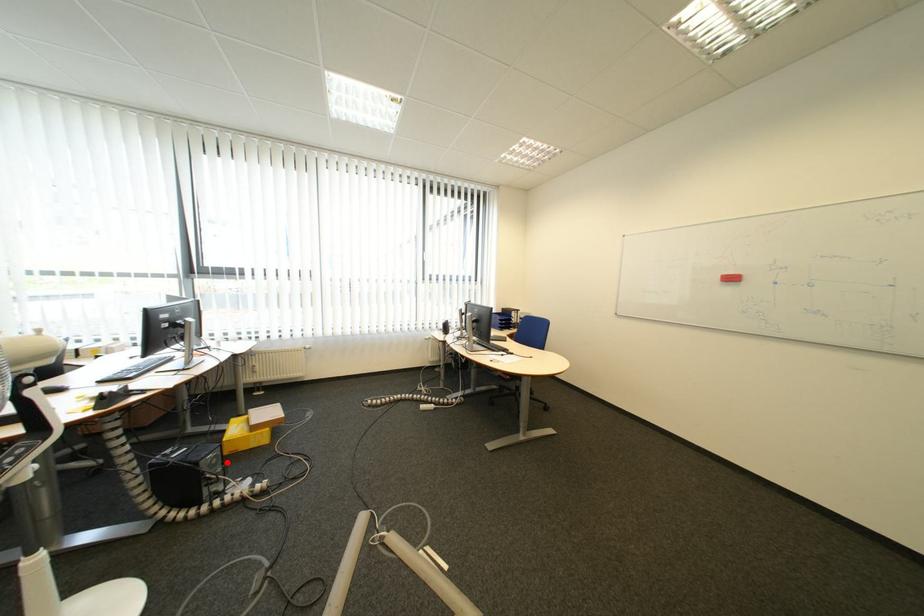
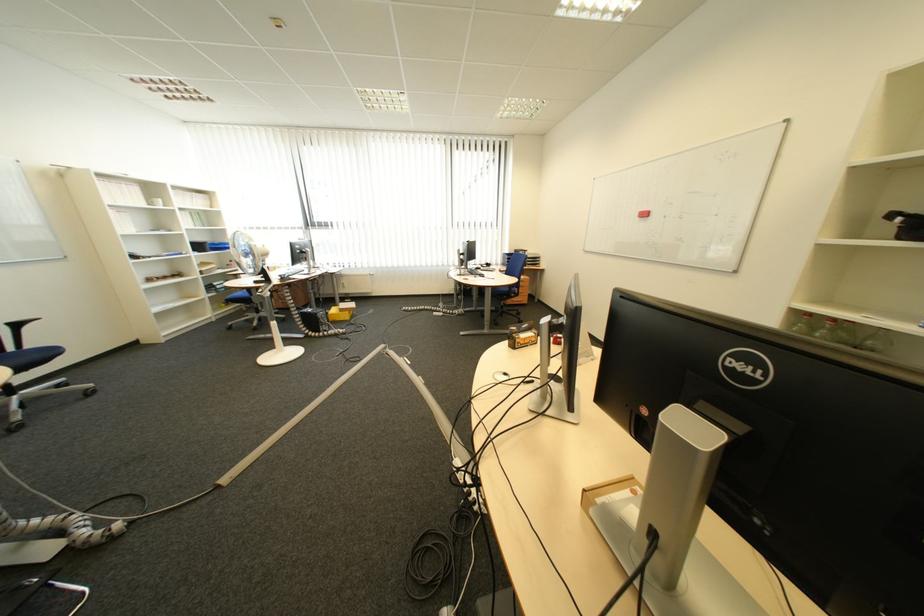
Question: I am providing you with two images of the same scene from different viewpoints. A red point is shown in image1. For the corresponding object point in image2, is it positioned nearer or farther from the camera?

Choices:
 (A) Nearer
 (B) Farther

Answer: (A)